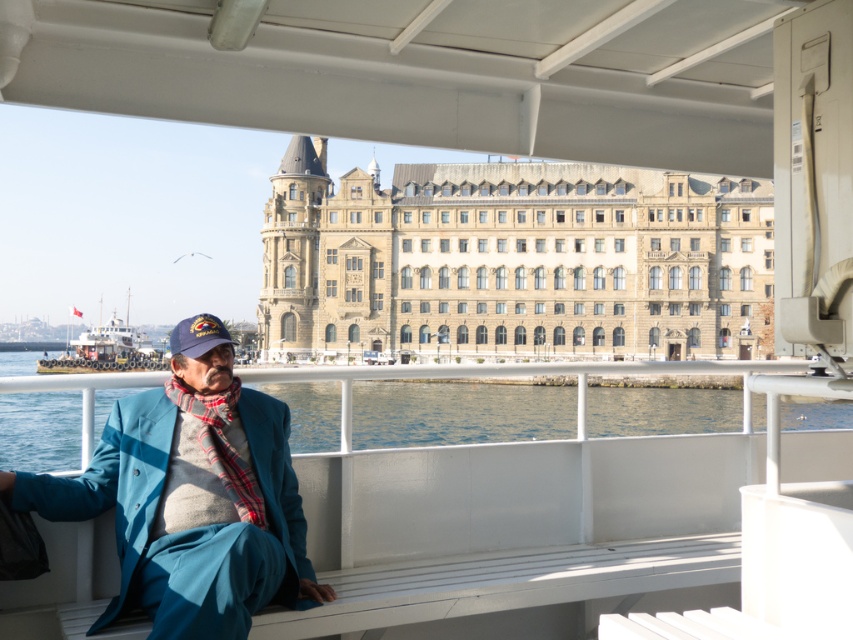
Looking at this image, does teal woolen suit at left have a greater height compared to plaid wool scarf at center?

Yes, teal woolen suit at left is taller than plaid wool scarf at center.

Can you confirm if teal woolen suit at left is positioned to the left of plaid wool scarf at center?

Indeed, teal woolen suit at left is positioned on the left side of plaid wool scarf at center.

Is point (173, 452) behind point (187, 403)?

That is False.

Locate an element on the screen. teal woolen suit at left is located at coordinates (192, 497).

Between teal woolen suit at left and clear blue water at lower left, which one is positioned higher?

Positioned higher is clear blue water at lower left.

Is teal woolen suit at left bigger than clear blue water at lower left?

No.

Between point (252, 588) and point (316, 438), which one is positioned behind?

Positioned behind is point (316, 438).

This screenshot has width=853, height=640. Find the location of `teal woolen suit at left`. teal woolen suit at left is located at coordinates (192, 497).

Can you confirm if clear blue water at lower left is wider than plaid wool scarf at center?

Indeed, clear blue water at lower left has a greater width compared to plaid wool scarf at center.

Can you confirm if clear blue water at lower left is positioned above plaid wool scarf at center?

Actually, clear blue water at lower left is below plaid wool scarf at center.

The width and height of the screenshot is (853, 640). What do you see at coordinates (459, 412) in the screenshot?
I see `clear blue water at lower left` at bounding box center [459, 412].

Where is `clear blue water at lower left`? The image size is (853, 640). clear blue water at lower left is located at coordinates (459, 412).